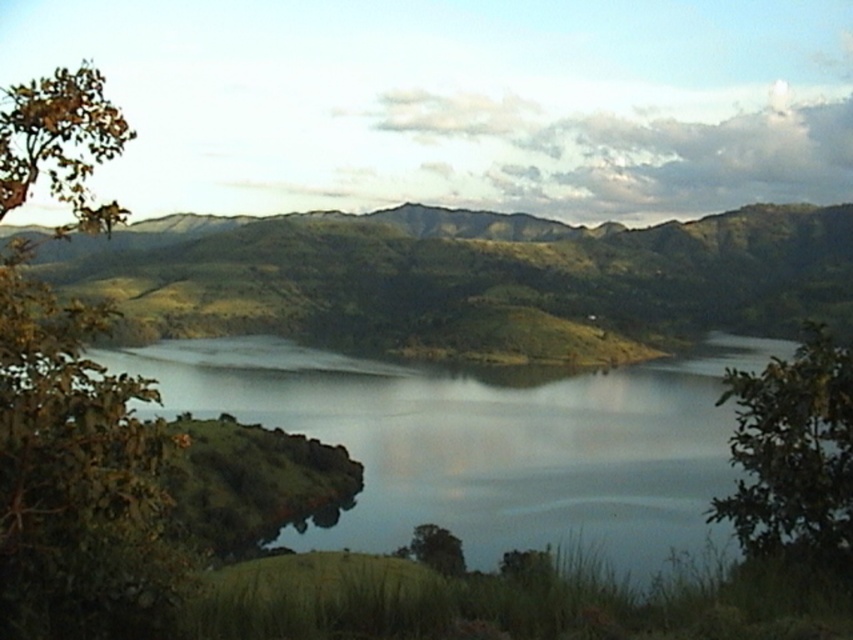
How much distance is there between brown leafy tree at left and green leafy tree at lower right?

brown leafy tree at left and green leafy tree at lower right are 6.34 meters apart from each other.

Is brown leafy tree at left to the left of green leafy tree at lower right from the viewer's perspective?

Yes, brown leafy tree at left is to the left of green leafy tree at lower right.

Between point (117, 504) and point (838, 358), which one is positioned in front?

Point (117, 504)

Locate an element on the screen. The image size is (853, 640). brown leafy tree at left is located at coordinates (76, 477).

Can you confirm if green grassy hill at center is shorter than green matte tree at center?

Incorrect, green grassy hill at center's height does not fall short of green matte tree at center's.

The image size is (853, 640). I want to click on green grassy hill at center, so click(471, 278).

I want to click on green grassy hill at center, so click(x=471, y=278).

Based on the photo, can you confirm if green leafy tree at lower right is positioned to the left of green matte tree at center?

No, green leafy tree at lower right is not to the left of green matte tree at center.

Which is above, green leafy tree at lower right or green matte tree at center?

green leafy tree at lower right is higher up.

I want to click on green leafy tree at lower right, so click(793, 456).

Find the location of `green leafy tree at lower right`. green leafy tree at lower right is located at coordinates (793, 456).